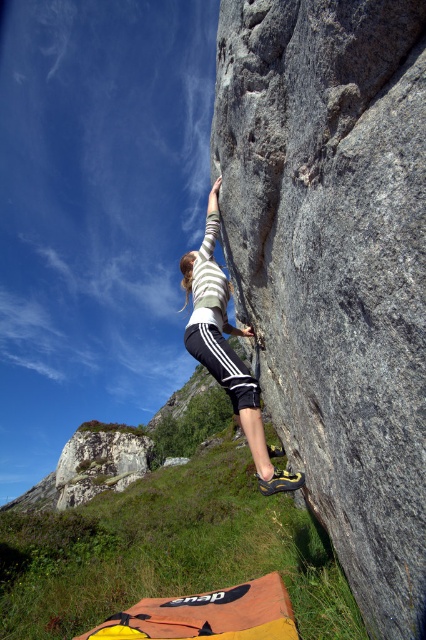
Who is positioned more to the left, gray rough rock at center or white striped shirt at center?

From the viewer's perspective, white striped shirt at center appears more on the left side.

Which is above, gray rough rock at center or white striped shirt at center?

gray rough rock at center is above.

Find the location of a particular element. The width and height of the screenshot is (426, 640). gray rough rock at center is located at coordinates (334, 266).